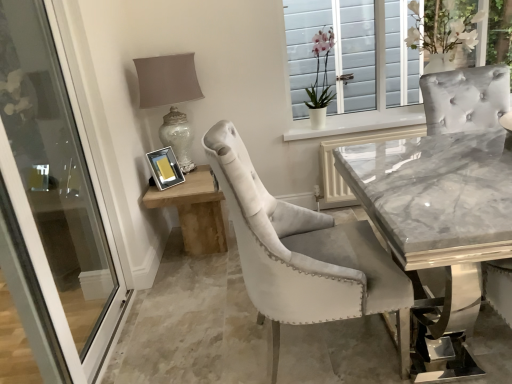
Find the location of `vacant area located to the right-hand side of metallic silver picture frame at upper center`. vacant area located to the right-hand side of metallic silver picture frame at upper center is located at coordinates (192, 181).